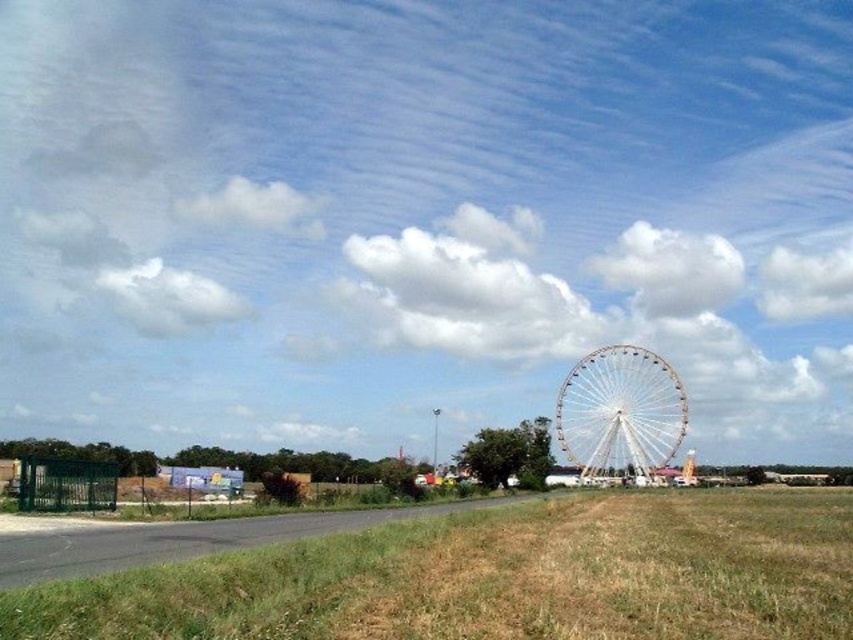
You are standing at point (500, 564) and want to reach the Ferris wheel in the background. The path is straight but has a fence on the left side of the road. If the road is 10 meters wide, can you walk directly towards the Ferris wheel without crossing the road?

The distance between you and the Ferris wheel is 163.79 meters. Since the road is 10 meters wide and the fence is on the left side, you can walk directly towards the Ferris wheel without crossing the road by staying on the grassy area on the right side of the road.

You are standing at the edge of the grassy area and want to walk towards the white metallic ferris wheel at center. Which direction should you walk to avoid stepping on the dry grass at lower center?

You should walk to the right of the white metallic ferris wheel at center to avoid stepping on the dry grass at lower center, since the dry grass at lower center is located to the left of the white metallic ferris wheel at center.

You are standing at the point marked as point (496,577) in the image. What is the closest object to you in the scene?

The closest object to you at point (496,577) is the dry grass at lower center because it is located exactly at that coordinate.